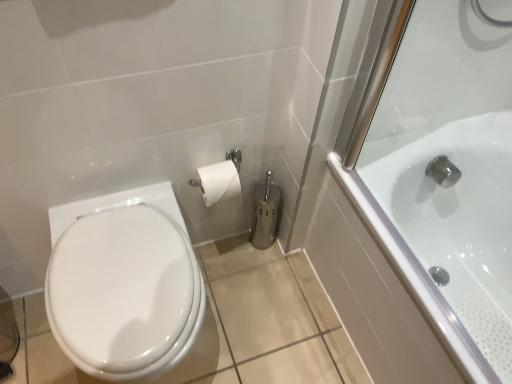
This screenshot has width=512, height=384. What do you see at coordinates (450, 235) in the screenshot?
I see `white glossy bathtub at right` at bounding box center [450, 235].

This screenshot has width=512, height=384. I want to click on white glossy bathtub at right, so click(450, 235).

What are the coordinates of `white glossy bidet at lower left` in the screenshot? It's located at (124, 293).

Describe the element at coordinates (124, 293) in the screenshot. I see `white glossy bidet at lower left` at that location.

Locate an element on the screen. This screenshot has height=384, width=512. white glossy bathtub at right is located at coordinates (450, 235).

Can you confirm if white glossy bidet at lower left is positioned to the right of white glossy bathtub at right?

Incorrect, white glossy bidet at lower left is not on the right side of white glossy bathtub at right.

Which object is closer to the camera, white glossy bidet at lower left or white glossy bathtub at right?

white glossy bathtub at right is more forward.

Does point (174, 357) lie in front of point (414, 171)?

Yes, point (174, 357) is closer to viewer.

From the image's perspective, would you say white glossy bidet at lower left is positioned over white glossy bathtub at right?

Actually, white glossy bidet at lower left appears below white glossy bathtub at right in the image.

From a real-world perspective, between white glossy bidet at lower left and white glossy bathtub at right, who is vertically higher?

white glossy bidet at lower left.

Considering the relative sizes of white glossy bidet at lower left and white glossy bathtub at right in the image provided, is white glossy bidet at lower left wider than white glossy bathtub at right?

No, white glossy bidet at lower left is not wider than white glossy bathtub at right.

Considering the relative sizes of white glossy bidet at lower left and white glossy bathtub at right in the image provided, is white glossy bidet at lower left taller than white glossy bathtub at right?

No, white glossy bidet at lower left is not taller than white glossy bathtub at right.

Which of these two, white glossy bidet at lower left or white glossy bathtub at right, is smaller?

Smaller between the two is white glossy bidet at lower left.

Could white glossy bathtub at right be considered to be inside white glossy bidet at lower left?

No, white glossy bidet at lower left does not contain white glossy bathtub at right.

Can you see white glossy bidet at lower left touching white glossy bathtub at right?

There is a gap between white glossy bidet at lower left and white glossy bathtub at right.

Does white glossy bidet at lower left turn towards white glossy bathtub at right?

No, white glossy bidet at lower left is not facing towards white glossy bathtub at right.

How many degrees apart are the facing directions of white glossy bidet at lower left and white glossy bathtub at right?

89.5 degrees separate the facing orientations of white glossy bidet at lower left and white glossy bathtub at right.

Identify the location of bidet that is above the white glossy bathtub at right (from a real-world perspective). The image size is (512, 384). (124, 293).

Is white glossy bathtub at right at the right side of white glossy bidet at lower left?

Indeed, white glossy bathtub at right is positioned on the right side of white glossy bidet at lower left.

Based on the photo, considering the positions of objects white glossy bathtub at right and white glossy bidet at lower left in the image provided, who is behind, white glossy bathtub at right or white glossy bidet at lower left?

white glossy bidet at lower left is further from the camera.

Is point (467, 269) closer to camera compared to point (62, 258)?

No, (467, 269) is further to viewer.

In the scene shown: From the image's perspective, is white glossy bathtub at right below white glossy bidet at lower left?

Actually, white glossy bathtub at right appears above white glossy bidet at lower left in the image.

From a real-world perspective, is white glossy bathtub at right under white glossy bidet at lower left?

Yes.

Does white glossy bathtub at right have a lesser width compared to white glossy bidet at lower left?

No, white glossy bathtub at right is not thinner than white glossy bidet at lower left.

Is white glossy bathtub at right taller or shorter than white glossy bidet at lower left?

white glossy bathtub at right is taller than white glossy bidet at lower left.

Who is smaller, white glossy bathtub at right or white glossy bidet at lower left?

white glossy bidet at lower left is smaller.

Is white glossy bathtub at right not within white glossy bidet at lower left?

Yes, white glossy bathtub at right is located beyond the bounds of white glossy bidet at lower left.

Looking at this image, is white glossy bathtub at right far away from white glossy bidet at lower left?

No, there isn't a large distance between white glossy bathtub at right and white glossy bidet at lower left.

Is white glossy bathtub at right facing away from white glossy bidet at lower left?

white glossy bathtub at right is not turned away from white glossy bidet at lower left.

In the scene shown: How different are the orientations of white glossy bathtub at right and white glossy bidet at lower left in degrees?

The facing directions of white glossy bathtub at right and white glossy bidet at lower left are 89.5 degrees apart.

How much distance is there between white glossy bathtub at right and white glossy bidet at lower left?

white glossy bathtub at right is 27.01 inches from white glossy bidet at lower left.

At what (x,y) coordinates should I click in order to perform the action: click on bathtub that appears on the right of white glossy bidet at lower left. Please return your answer as a coordinate pair (x, y). Looking at the image, I should click on (450, 235).

Locate an element on the screen. The height and width of the screenshot is (384, 512). bathtub above the white glossy bidet at lower left (from the image's perspective) is located at coordinates (450, 235).

The width and height of the screenshot is (512, 384). In order to click on bathtub in front of the white glossy bidet at lower left in this screenshot , I will do `click(450, 235)`.